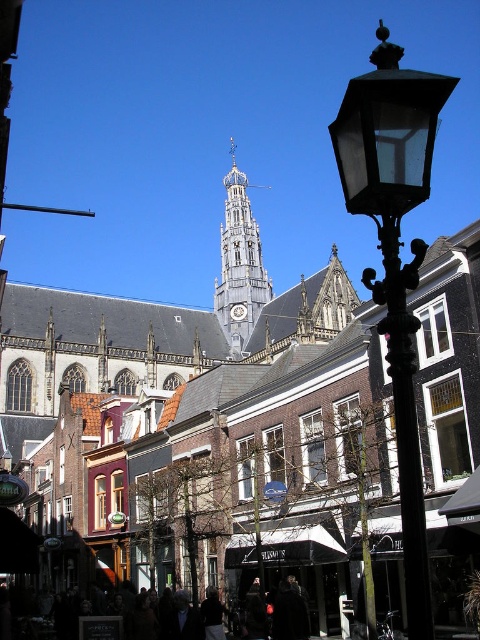
Question: Can you confirm if wooden spire at center is positioned above dark clothing at lower center?

Choices:
 (A) yes
 (B) no

Answer: (A)

Question: Is wooden spire at center smaller than metallic clock at center?

Choices:
 (A) yes
 (B) no

Answer: (B)

Question: Based on their relative distances, which object is nearer to the dark clothing at lower center?

Choices:
 (A) wooden spire at center
 (B) matte black street lamp at right
 (C) metallic clock at center

Answer: (B)

Question: Is dark clothing at lower center wider than metallic clock at center?

Choices:
 (A) no
 (B) yes

Answer: (B)

Question: Among these objects, which one is farthest from the camera?

Choices:
 (A) matte black street lamp at right
 (B) wooden spire at center
 (C) dark clothing at lower center
 (D) metallic clock at center

Answer: (D)

Question: Which is farther from the metallic clock at center?

Choices:
 (A) matte black street lamp at right
 (B) wooden spire at center
 (C) dark clothing at lower center

Answer: (A)